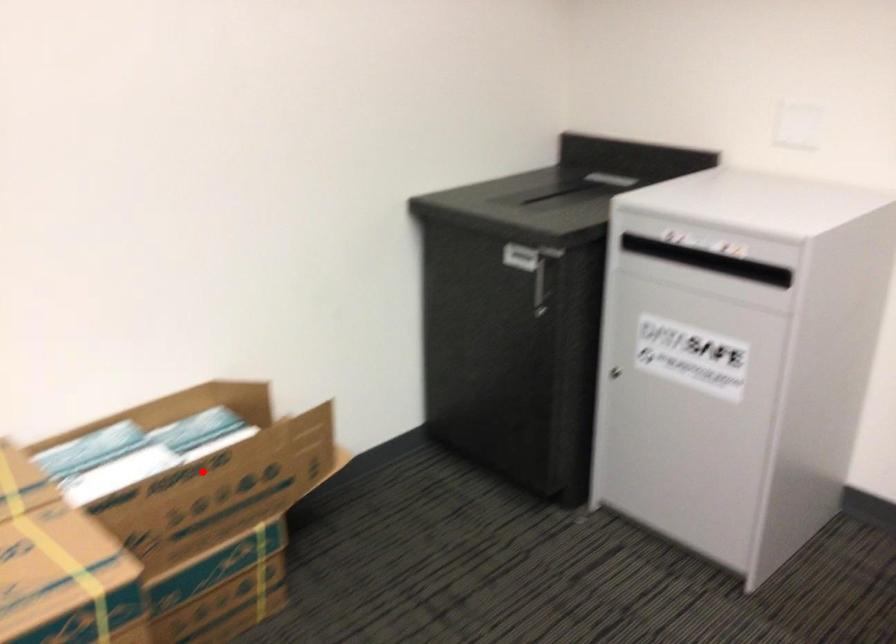
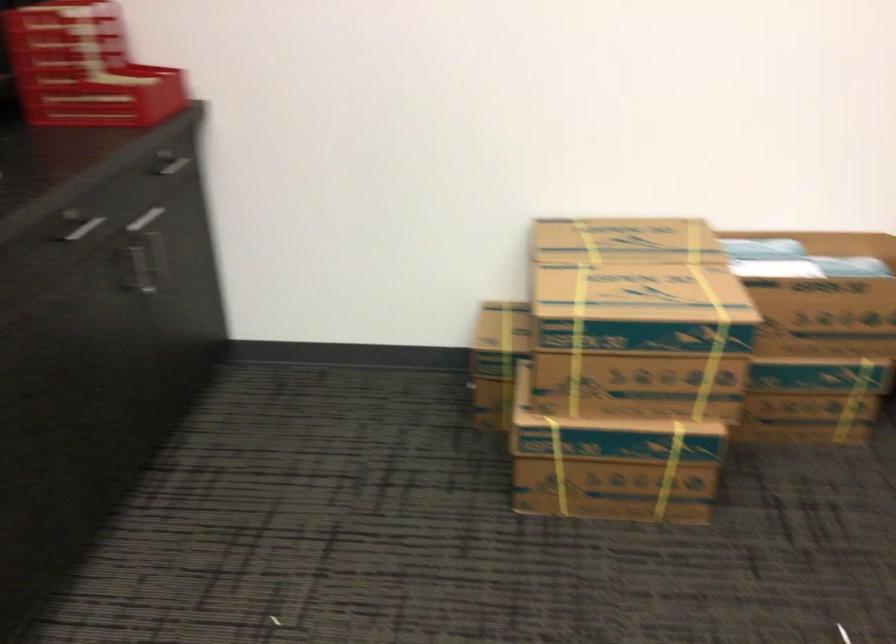
Question: A red point is marked in image1. In image2, is the corresponding 3D point closer to the camera or farther? Reply with the corresponding letter.

Choices:
 (A) The corresponding 3D point is closer.
 (B) The corresponding 3D point is farther.

Answer: (B)